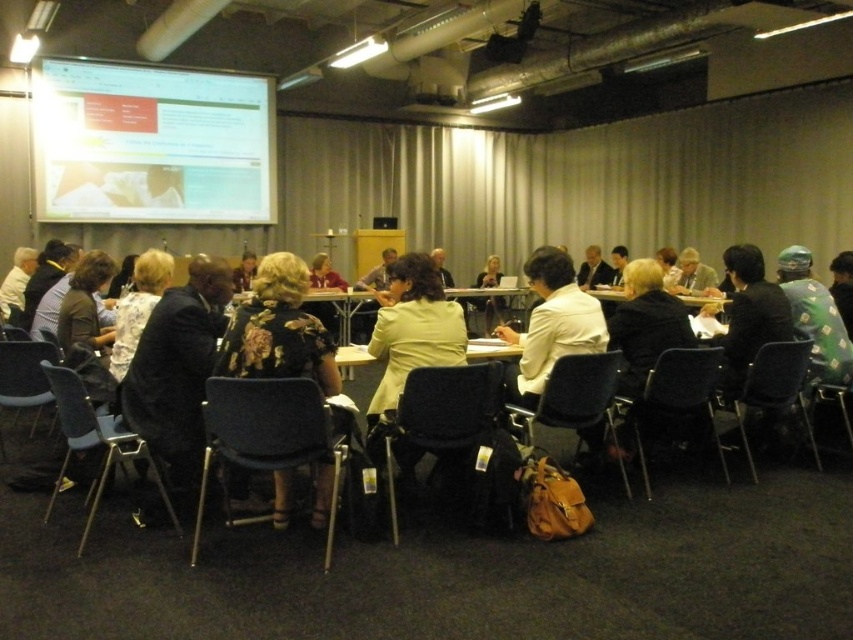
Who is higher up, black suit at left or metallic blue chair at lower left?

black suit at left is above.

Which is behind, point (167, 371) or point (84, 449)?

Positioned behind is point (167, 371).

Locate an element on the screen. The image size is (853, 640). black suit at left is located at coordinates (177, 374).

Does metallic blue chair at lower left have a lesser width compared to matte black chair at lower right?

No.

The width and height of the screenshot is (853, 640). Identify the location of metallic blue chair at lower left. (94, 442).

From the picture: Between white glossy projection screen at upper left and black plastic chair at center, which one is positioned lower?

Positioned lower is black plastic chair at center.

Does white glossy projection screen at upper left have a lesser width compared to black plastic chair at center?

Incorrect, white glossy projection screen at upper left's width is not less than black plastic chair at center's.

Is point (105, 120) less distant than point (671, 410)?

No, (105, 120) is behind (671, 410).

Identify the location of white glossy projection screen at upper left. Image resolution: width=853 pixels, height=640 pixels. (151, 145).